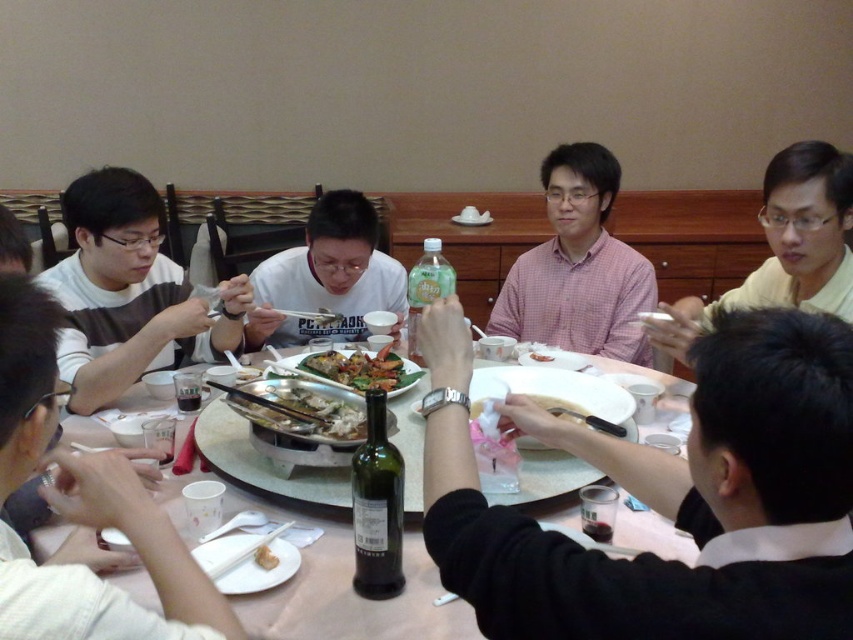
Question: Can you confirm if matte white shirt at left is positioned to the right of white plastic chopstick at center?

Choices:
 (A) no
 (B) yes

Answer: (A)

Question: Does black matte shirt at center appear on the right side of white matte bread at center?

Choices:
 (A) no
 (B) yes

Answer: (B)

Question: Which point appears closest to the camera in this image?

Choices:
 (A) (341, 404)
 (B) (631, 288)

Answer: (A)

Question: Which object is farther from the camera taking this photo?

Choices:
 (A) white matte shirt at center
 (B) white striped sweater at left
 (C) yellow shirt at upper right

Answer: (A)

Question: Is the position of pink checkered shirt at center less distant than that of white matte shirt at center?

Choices:
 (A) yes
 (B) no

Answer: (B)

Question: Based on their relative distances, which object is farther from the white striped sweater at left?

Choices:
 (A) wooden chopsticks at center
 (B) white plastic chopstick at center

Answer: (B)